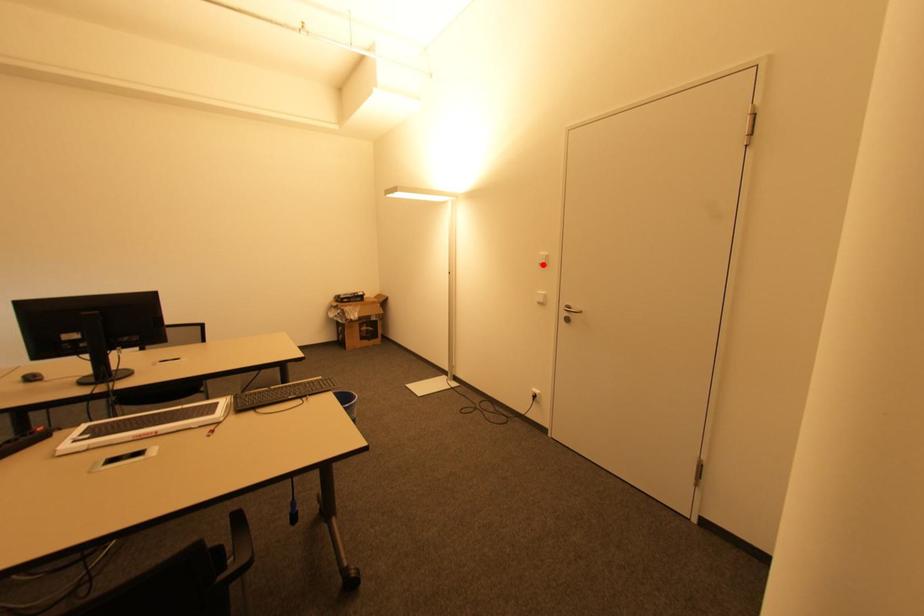
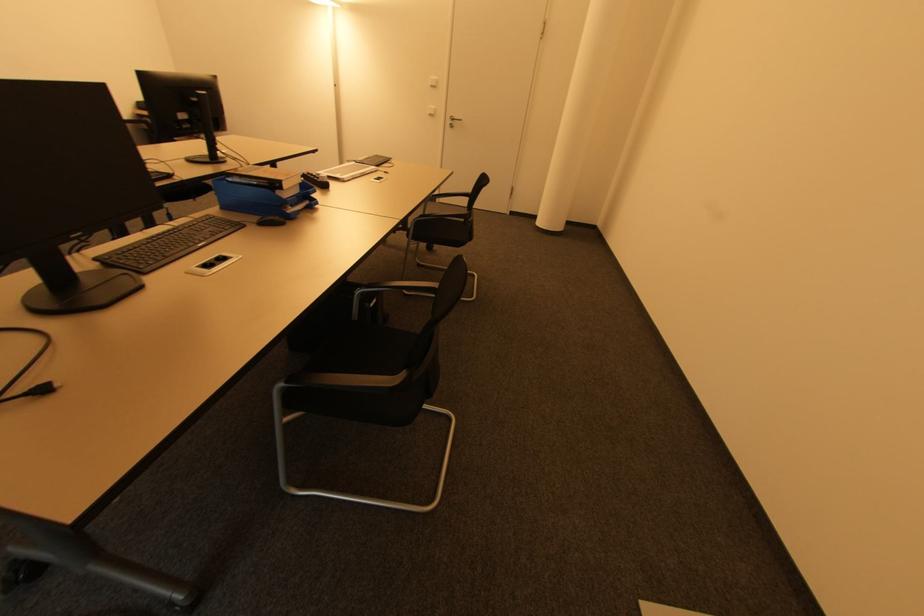
Question: A red point is marked in image1. In image2, is the corresponding 3D point closer to the camera or farther? Reply with the corresponding letter.

Choices:
 (A) The corresponding 3D point is closer.
 (B) The corresponding 3D point is farther.

Answer: (A)